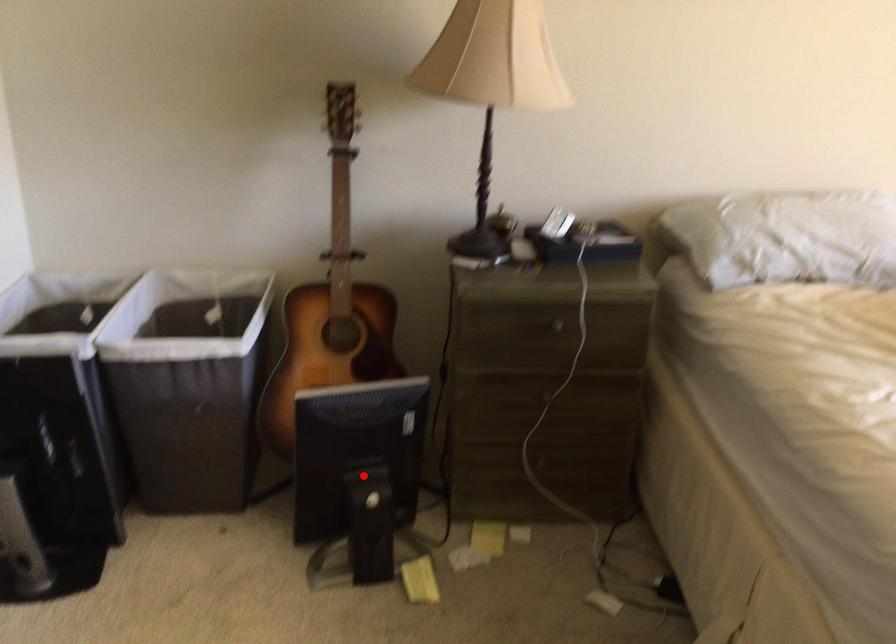
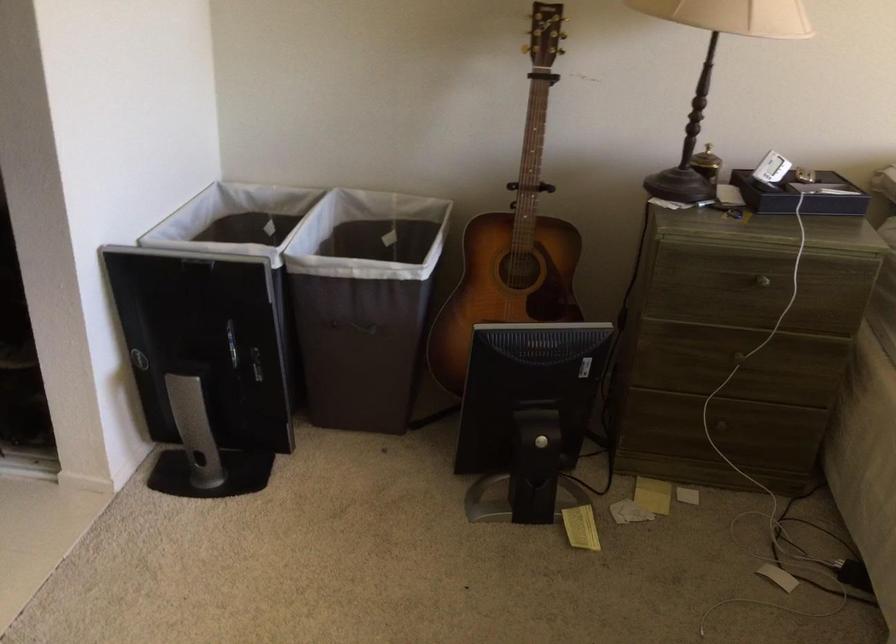
Find the pixel in the second image that matches the highlighted location in the first image.

(528, 415)